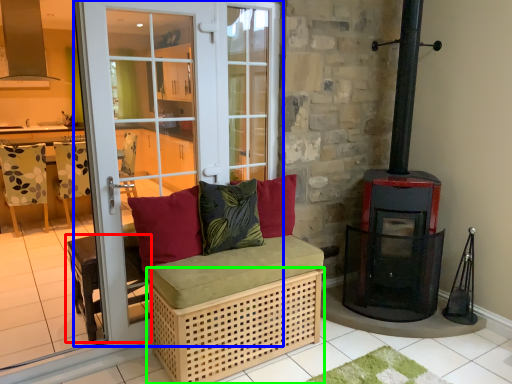
Question: Based on their relative distances, which object is farther from furniture (highlighted by a red box)? Choose from door (highlighted by a blue box) and crate (highlighted by a green box).

Choices:
 (A) door
 (B) crate

Answer: (B)